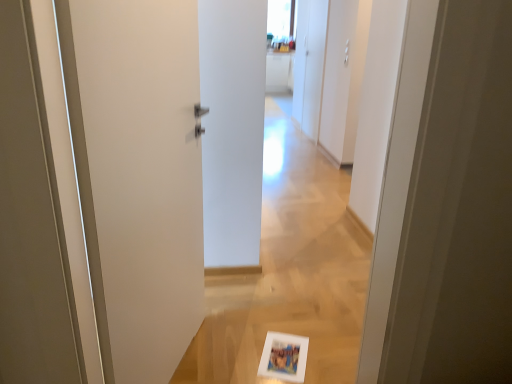
Question: Considering the relative sizes of white matte cabinet at upper right and white matte door at left in the image provided, is white matte cabinet at upper right taller than white matte door at left?

Choices:
 (A) no
 (B) yes

Answer: (B)

Question: Can you confirm if white matte cabinet at upper right is wider than white matte door at left?

Choices:
 (A) yes
 (B) no

Answer: (B)

Question: Could you tell me if white matte cabinet at upper right is facing white matte door at left?

Choices:
 (A) no
 (B) yes

Answer: (A)

Question: Can you confirm if white matte cabinet at upper right is bigger than white matte door at left?

Choices:
 (A) yes
 (B) no

Answer: (A)

Question: Is white matte door at left at the back of white matte cabinet at upper right?

Choices:
 (A) no
 (B) yes

Answer: (A)

Question: Would you say white matte cabinet at upper right is outside white matte door at left?

Choices:
 (A) yes
 (B) no

Answer: (A)

Question: Is white matte door at left thinner than white matte cabinet at upper right?

Choices:
 (A) yes
 (B) no

Answer: (B)

Question: Does white matte door at left have a smaller size compared to white matte cabinet at upper right?

Choices:
 (A) no
 (B) yes

Answer: (B)

Question: Considering the relative positions of white matte door at left and white matte cabinet at upper right in the image provided, is white matte door at left to the right of white matte cabinet at upper right from the viewer's perspective?

Choices:
 (A) yes
 (B) no

Answer: (B)

Question: Can you confirm if white matte door at left is positioned to the left of white matte cabinet at upper right?

Choices:
 (A) yes
 (B) no

Answer: (A)

Question: Is white matte cabinet at upper right located within white matte door at left?

Choices:
 (A) yes
 (B) no

Answer: (B)

Question: Would you say white matte door at left is a long distance from white matte cabinet at upper right?

Choices:
 (A) no
 (B) yes

Answer: (B)

Question: Considering their positions, is white matte cabinet at upper right located in front of or behind white matte door at left?

Choices:
 (A) behind
 (B) front

Answer: (A)